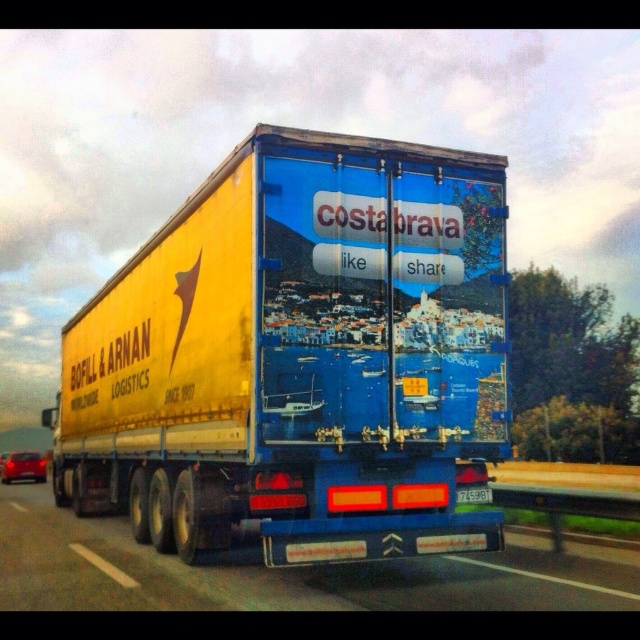
You are a photographer trying to capture the vibrant advertisement on the truck. You notice a specific point marked at coordinates (300, 356). What object is located at this point?

The point at coordinates (300, 356) marks the yellow matte trailer at center.

You are a photographer standing at the side of the road. You want to take a photo of the truck so that both point (400,387) and point (168,605) are clearly visible. Given that you can only move forward or backward along the road, which direction should you move to ensure both points are in focus?

To ensure both points are in focus, you should move backward along the road. Since point (400,387) is closer to the camera than point (168,605), moving backward will increase the depth of field, allowing both points to be in focus simultaneously.

You are a photographer planning to capture the entire truck and trailer in one shot. Based on the scene, which object should you focus on first to ensure both the yellow matte trailer at center and the blue glossy truck at center are fully visible in your frame?

You should focus on the blue glossy truck at center first because the yellow matte trailer at center might be wider than the blue glossy truck at center, so ensuring the truck is centered will help accommodate the trailer width in the frame.